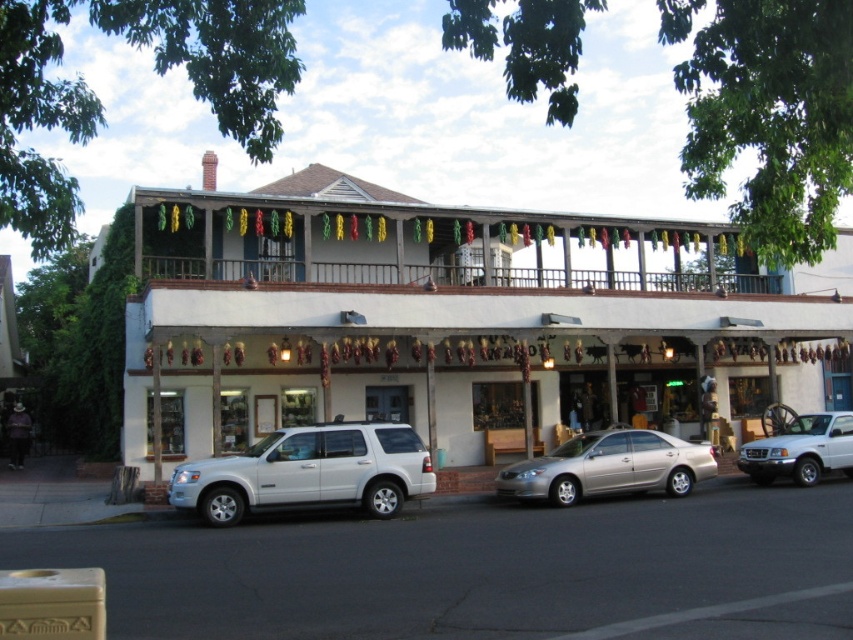
You are standing in the middle of the street looking at the white matte building at center and the white matte suv at lower left. Which object is closer to you?

The white matte building at center is closer to you than the white matte suv at lower left.